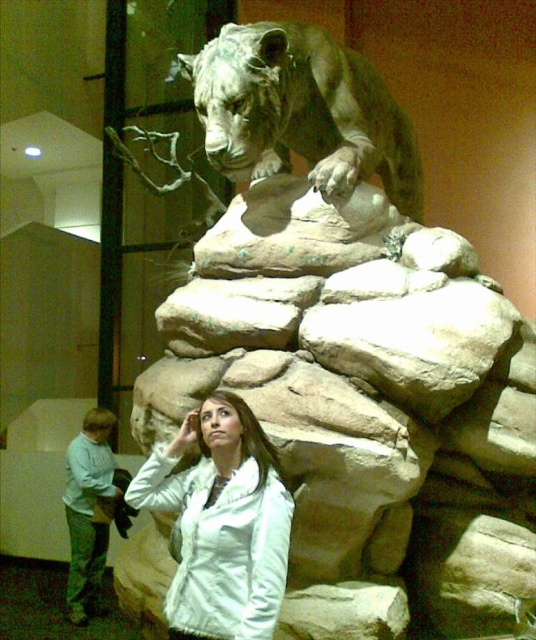
Between bronze statue of a lion at upper center and white matte jacket at center, which one appears on the right side from the viewer's perspective?

From the viewer's perspective, bronze statue of a lion at upper center appears more on the right side.

Is point (241, 70) positioned behind point (218, 564)?

Yes, it is.

At what (x,y) coordinates should I click in order to perform the action: click on bronze statue of a lion at upper center. Please return your answer as a coordinate pair (x, y). This screenshot has height=640, width=536. Looking at the image, I should click on (301, 112).